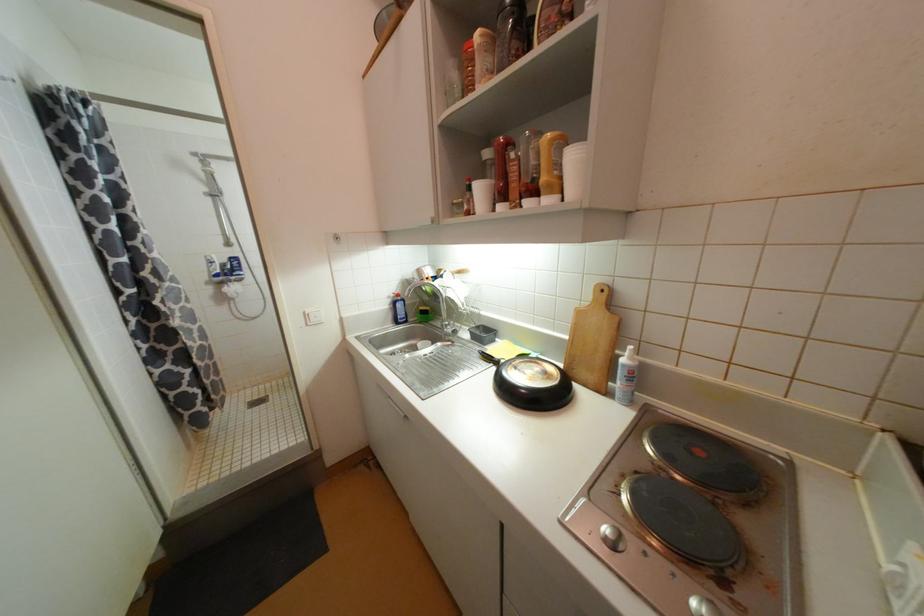
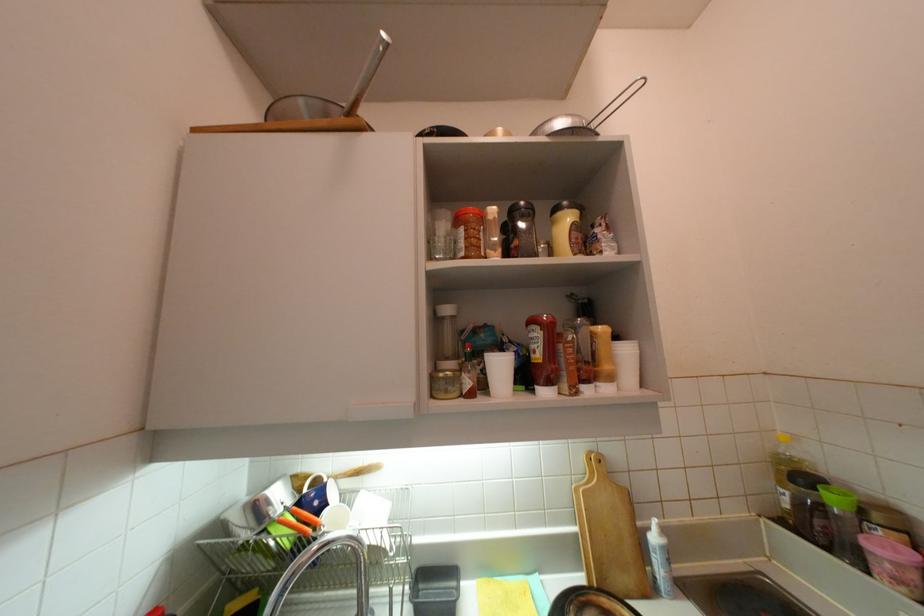
Where in the second image is the point corresponding to (628,361) from the first image?

(660, 540)